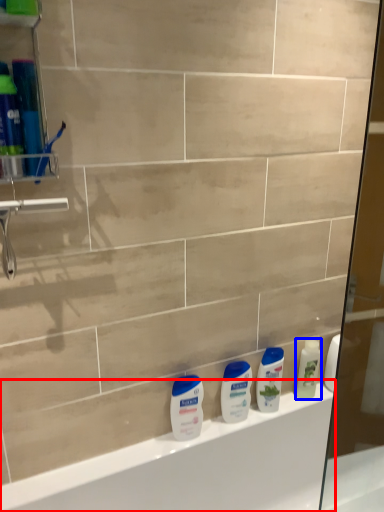
Question: Among these objects, which one is nearest to the camera, bathtub (highlighted by a red box) or cleaning product (highlighted by a blue box)?

Choices:
 (A) bathtub
 (B) cleaning product

Answer: (A)